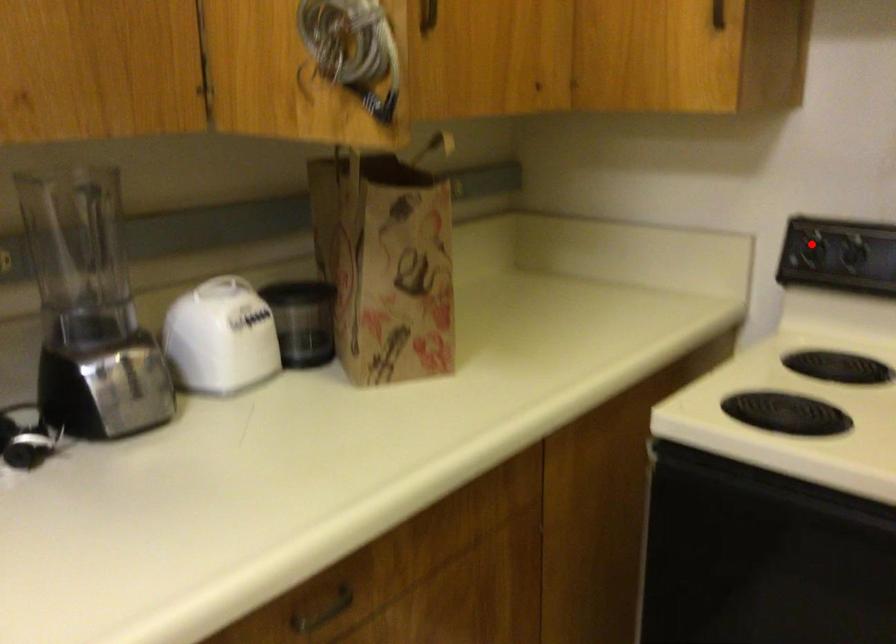
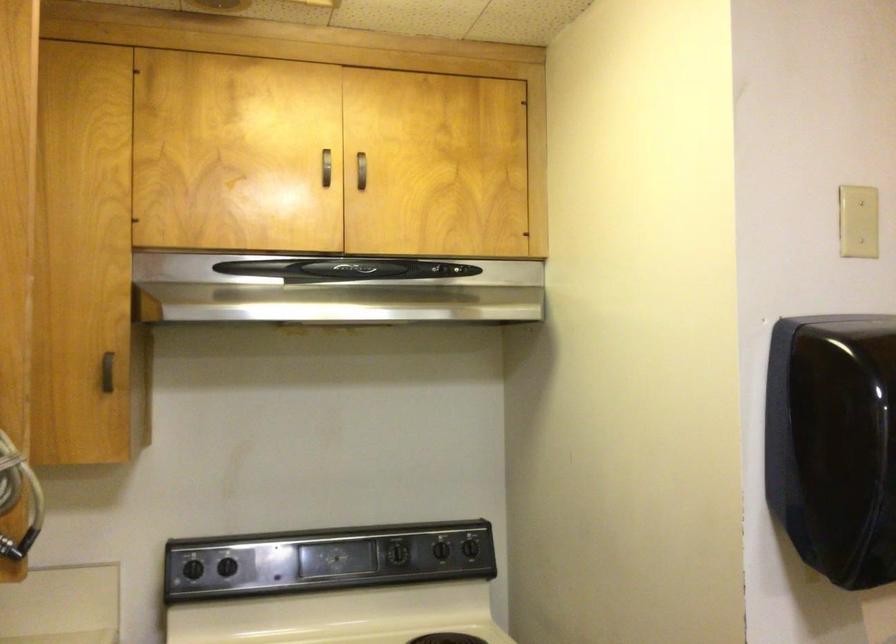
Question: A red point is marked in image1. In image2, is the corresponding 3D point closer to the camera or farther? Reply with the corresponding letter.

Choices:
 (A) The corresponding 3D point is closer.
 (B) The corresponding 3D point is farther.

Answer: (B)